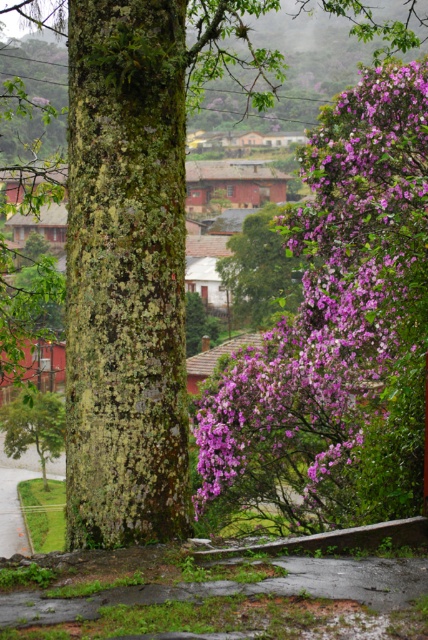
Question: Considering the real-world distances, which object is closest to the green mossy tree at lower left?

Choices:
 (A) green mossy bark at center
 (B) purple leafy tree at center
 (C) purple matte flower at right

Answer: (C)

Question: Which object is closer to the camera taking this photo?

Choices:
 (A) green mossy bark at center
 (B) green mossy tree at lower left
 (C) purple leafy tree at center

Answer: (A)

Question: Which object appears farthest from the camera in this image?

Choices:
 (A) purple matte flower at right
 (B) green mossy tree at lower left
 (C) purple leafy tree at center
 (D) green mossy bark at center

Answer: (C)

Question: Is purple matte flower at right above purple leafy tree at center?

Choices:
 (A) no
 (B) yes

Answer: (A)

Question: Does green mossy bark at center have a smaller size compared to green mossy tree at lower left?

Choices:
 (A) yes
 (B) no

Answer: (A)

Question: In this image, where is green mossy bark at center located relative to purple leafy tree at center?

Choices:
 (A) right
 (B) left

Answer: (B)